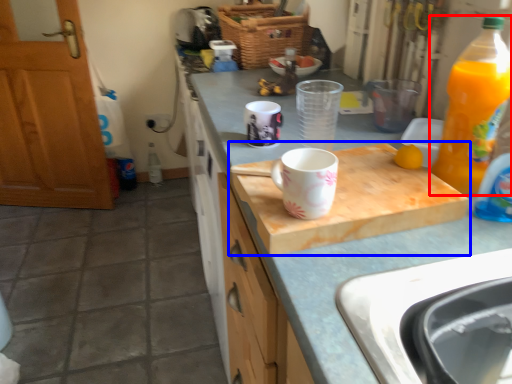
Question: Which point is further to the camera, bottle (highlighted by a red box) or cutting board (highlighted by a blue box)?

Choices:
 (A) bottle
 (B) cutting board

Answer: (B)